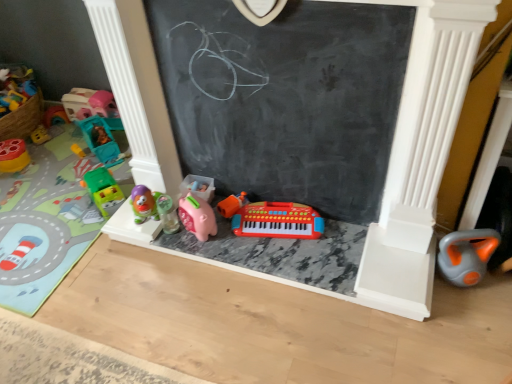
Locate an element on the screen. Image resolution: width=512 pixels, height=384 pixels. free point above green plastic toy car at left, the 7th toy positioned from the right (from a real-world perspective) is located at coordinates (49, 190).